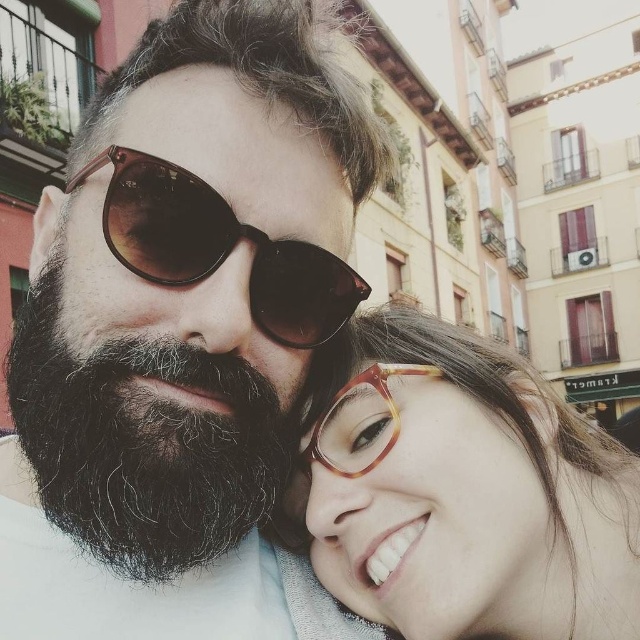
Question: Where is sunglasses at center located in relation to translucent tortoiseshell glasses at center in the image?

Choices:
 (A) above
 (B) below

Answer: (A)

Question: Does matte black sunglasses at center lie in front of tortoiseshell glasses at lower right?

Choices:
 (A) yes
 (B) no

Answer: (A)

Question: Which of the following is the closest to the observer?

Choices:
 (A) black fuzzy beard at center
 (B) matte black sunglasses at center

Answer: (B)

Question: Among these points, which one is nearest to the camera?

Choices:
 (A) (61, 452)
 (B) (496, 509)

Answer: (A)

Question: Which object appears closest to the camera in this image?

Choices:
 (A) black fuzzy beard at center
 (B) matte black sunglasses at center

Answer: (B)

Question: Is sunglasses at center thinner than translucent tortoiseshell glasses at center?

Choices:
 (A) no
 (B) yes

Answer: (A)